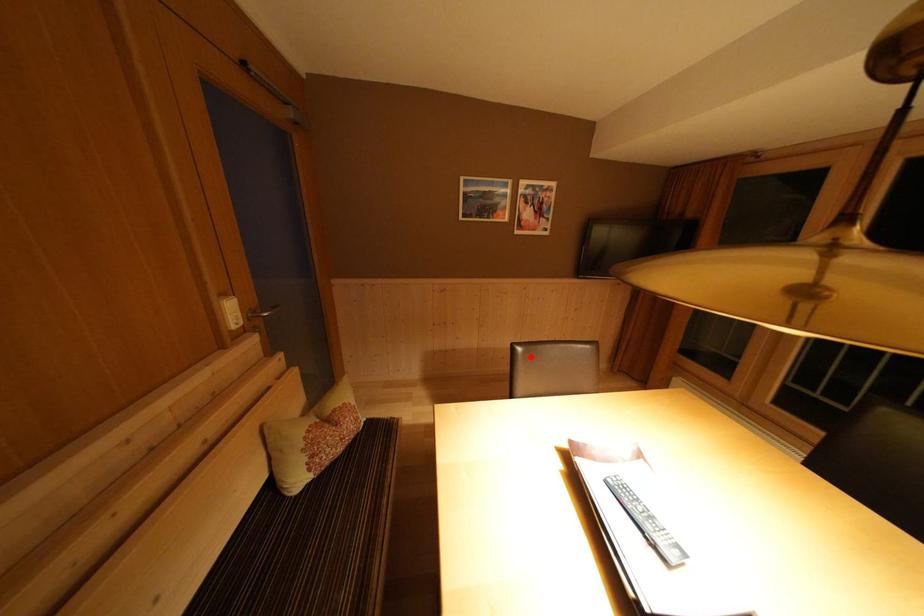
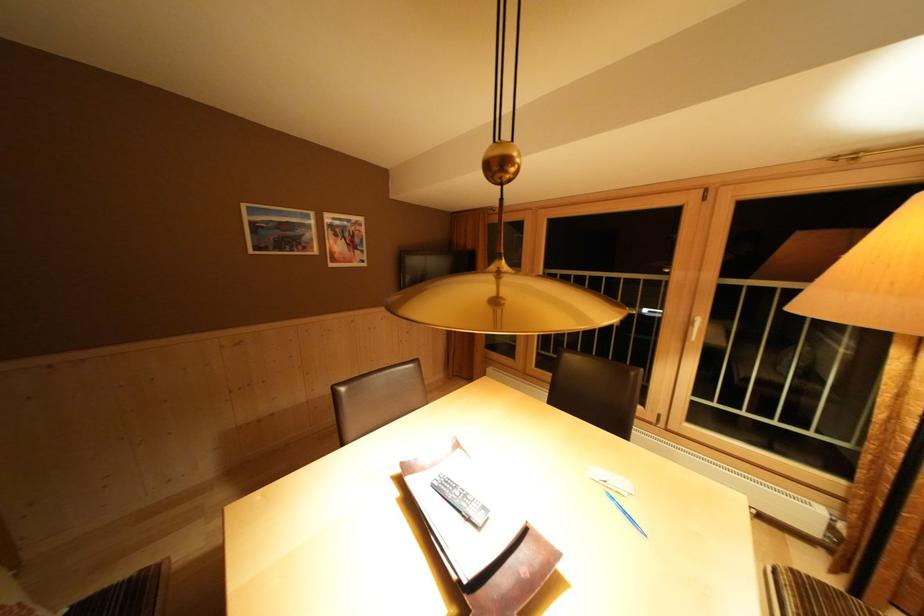
Find the pixel in the second image that matches the highlighted location in the first image.

(355, 395)